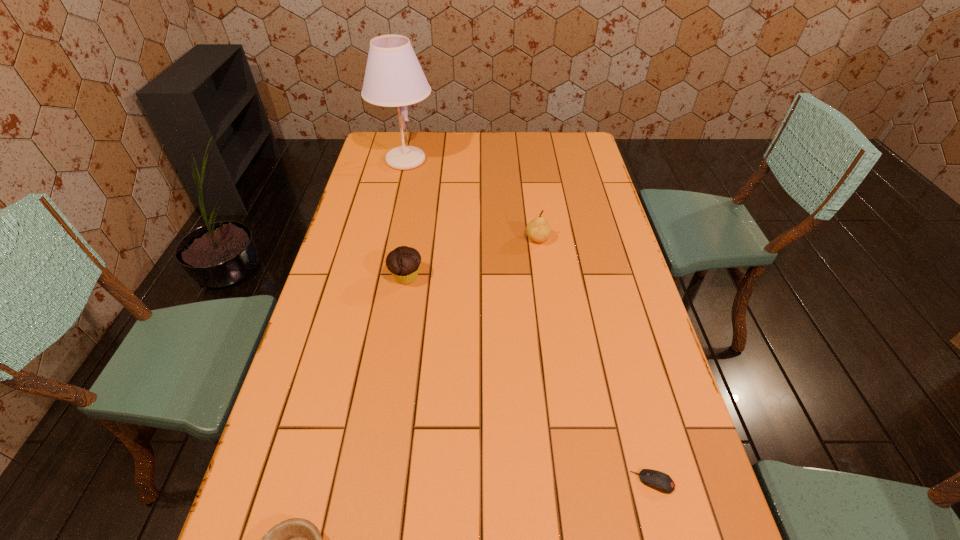
I want to click on vacant space located on the left of the fourth farthest object, so click(x=599, y=482).

The height and width of the screenshot is (540, 960). Find the location of `object at the far edge`. object at the far edge is located at coordinates click(393, 77).

The width and height of the screenshot is (960, 540). What are the coordinates of `object positioned at the left edge` in the screenshot? It's located at (393, 77).

You are a GUI agent. You are given a task and a screenshot of the screen. Output one action in this format:
    pyautogui.click(x=<x>, y=<y>)
    Task: Click on the object situated at the right edge
    This screenshot has width=960, height=540.
    Given the screenshot: What is the action you would take?
    pyautogui.click(x=657, y=480)

Identify the location of object at the far left corner. (393, 77).

Where is `free space at the far edge of the desktop`? The image size is (960, 540). free space at the far edge of the desktop is located at coordinates (422, 149).

Find the location of a particular element. The height and width of the screenshot is (540, 960). vacant region at the left edge of the desktop is located at coordinates (309, 479).

The image size is (960, 540). In the image, there is a desktop. Find the location of `free region at the right edge`. free region at the right edge is located at coordinates click(583, 188).

In the image, there is a desktop. At what (x,y) coordinates should I click in order to perform the action: click on blank space at the far right corner. Please return your answer as a coordinate pair (x, y). The width and height of the screenshot is (960, 540). Looking at the image, I should click on (561, 132).

Where is `free area in between the computer mouse and the muffin`? This screenshot has width=960, height=540. free area in between the computer mouse and the muffin is located at coordinates (530, 379).